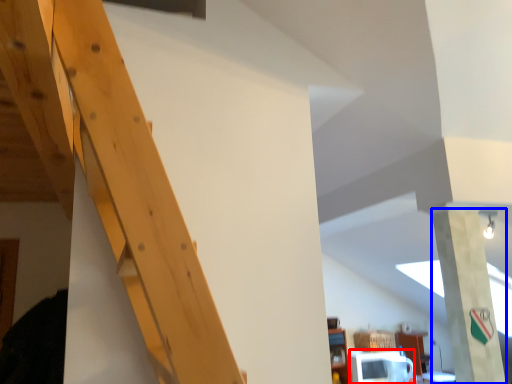
Question: Which object appears closest to the camera in this image, microwave (highlighted by a red box) or pillar (highlighted by a blue box)?

Choices:
 (A) microwave
 (B) pillar

Answer: (B)